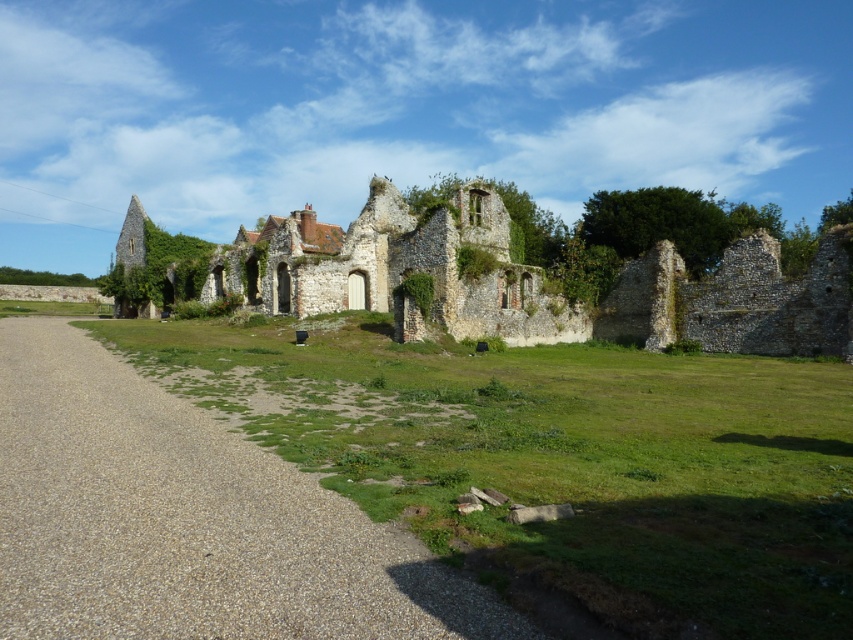
Which is above, gravelly path at center or stone ruins at center?

stone ruins at center is higher up.

This screenshot has width=853, height=640. Describe the element at coordinates (187, 520) in the screenshot. I see `gravelly path at center` at that location.

This screenshot has height=640, width=853. What are the coordinates of `gravelly path at center` in the screenshot? It's located at (187, 520).